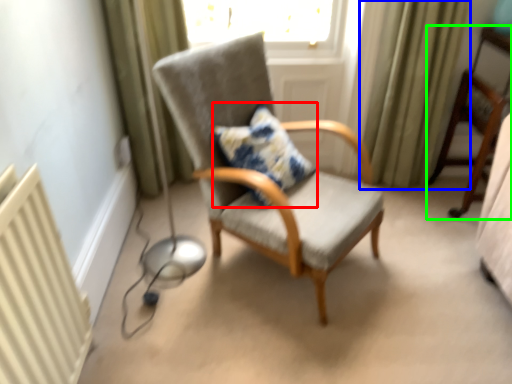
Question: Which is nearer to the pillow (highlighted by a red box)? curtain (highlighted by a blue box) or chair (highlighted by a green box).

Choices:
 (A) curtain
 (B) chair

Answer: (A)